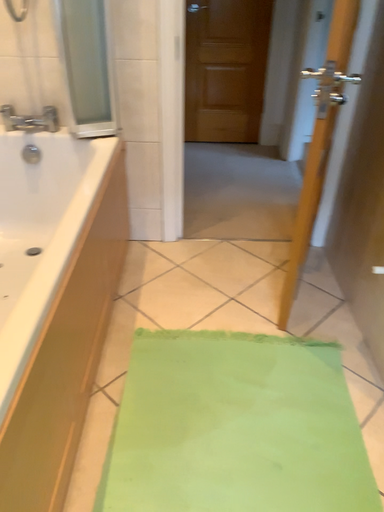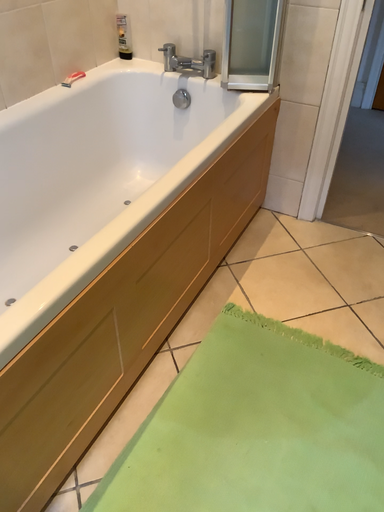
Question: Which way did the camera rotate in the video?

Choices:
 (A) rotated left
 (B) rotated right

Answer: (A)